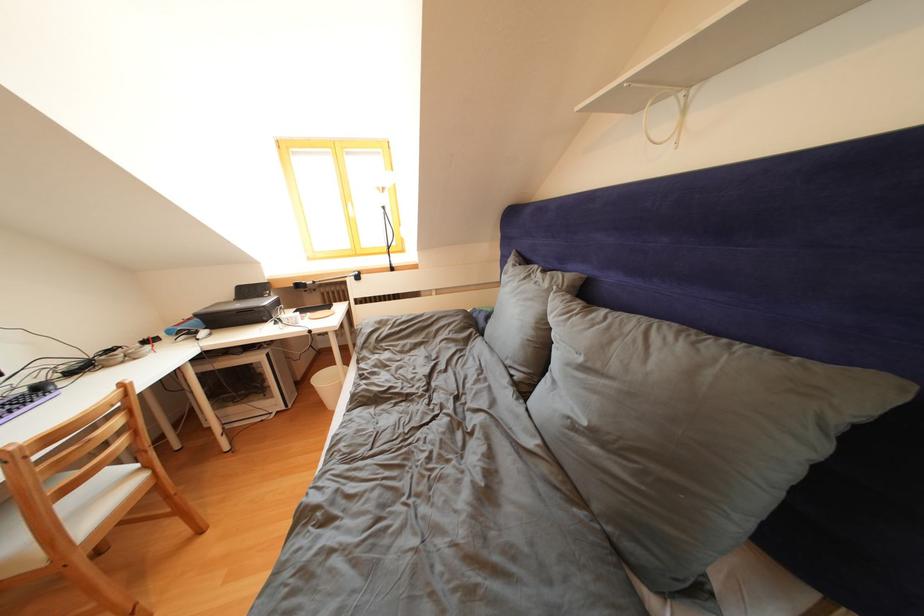
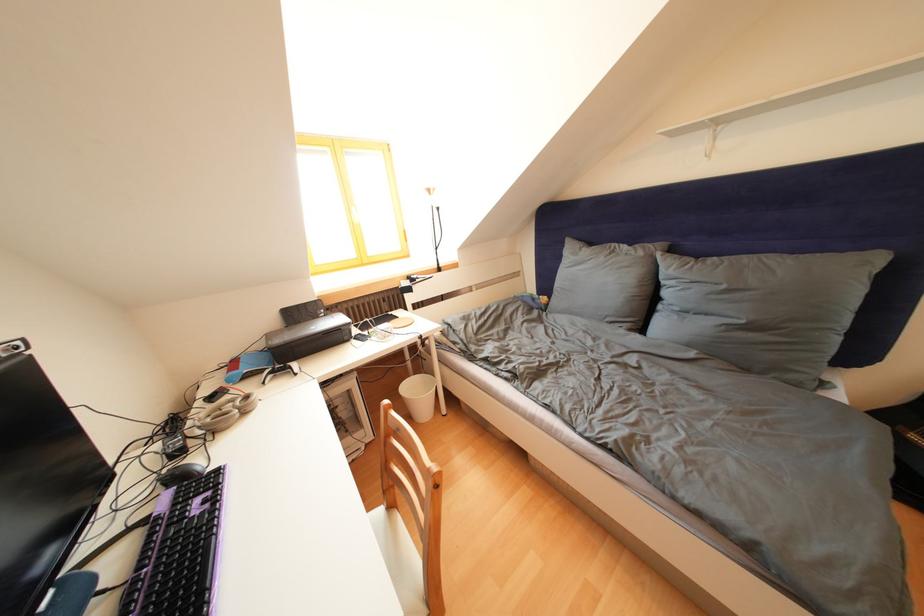
In the second image, find the point that corresponds to pixel 553 290 in the first image.

(649, 259)